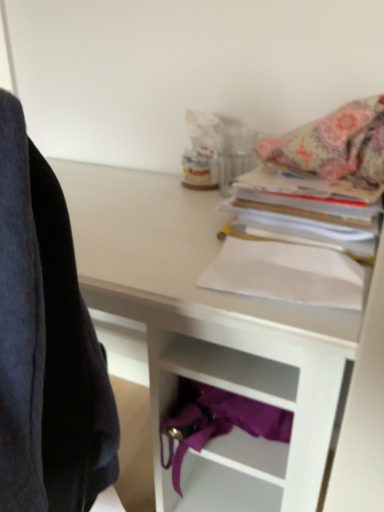
Question: Is point (200, 278) positioned closer to the camera than point (261, 196)?

Choices:
 (A) closer
 (B) farther

Answer: (A)

Question: Considering their positions, is white paper at center, positioned as the 2th paperback book in top-to-bottom order, located in front of or behind white paper at upper right, which is counted as the first paperback book, starting from the top?

Choices:
 (A) behind
 (B) front

Answer: (B)

Question: Which is nearer to the white paper at center, positioned as the 2th paperback book in top-to-bottom order?

Choices:
 (A) white paper at upper right, the second paperback book ordered from the bottom
 (B) patterned fabric blanket at upper right
 (C) white matte desk at upper center

Answer: (A)

Question: Estimate the real-world distances between objects in this image. Which object is farther from the white paper at center, positioned as the 2th paperback book in top-to-bottom order?

Choices:
 (A) white matte desk at upper center
 (B) patterned fabric blanket at upper right
 (C) white paper at upper right, which is counted as the first paperback book, starting from the top

Answer: (B)